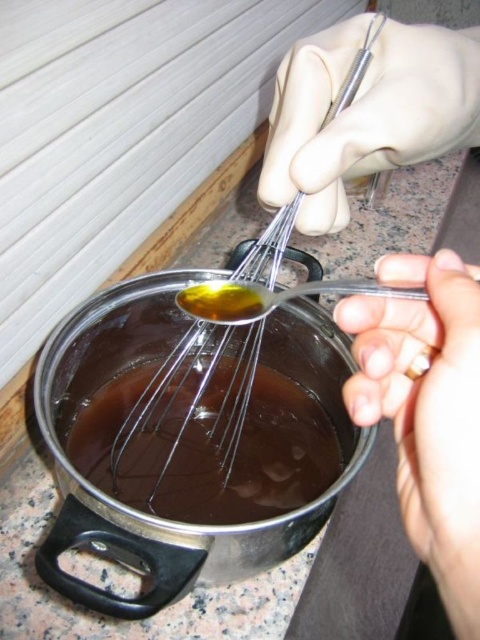
Is point (402, 102) less distant than point (474, 577)?

No.

Is white rubber glove at upper center closer to camera compared to smooth skin hand at center?

That is False.

Is point (457, 301) less distant than point (360, 321)?

Yes.

Find the location of `white rubber glove at upper center`. white rubber glove at upper center is located at coordinates (427, 412).

Which is more to the right, white rubber glove at upper center or metallic whisk at center?

From the viewer's perspective, white rubber glove at upper center appears more on the right side.

Is point (423, 513) closer to viewer compared to point (180, 406)?

Yes, point (423, 513) is closer to viewer.

Is point (414, 32) less distant than point (213, 460)?

Yes, point (414, 32) is in front of point (213, 460).

Identify the location of white rubber glove at upper center. Image resolution: width=480 pixels, height=640 pixels. (427, 412).

Is white latex glove at upper center closer to camera compared to metallic whisk at center?

Yes, white latex glove at upper center is in front of metallic whisk at center.

Who is lower down, white latex glove at upper center or metallic whisk at center?

metallic whisk at center

What do you see at coordinates (365, 113) in the screenshot?
I see `white latex glove at upper center` at bounding box center [365, 113].

The width and height of the screenshot is (480, 640). Identify the location of white latex glove at upper center. (365, 113).